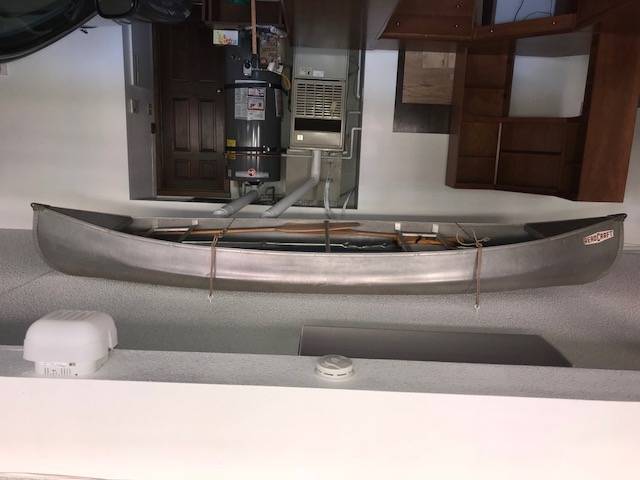
Locate an element on the screen. door is located at coordinates (193, 119).